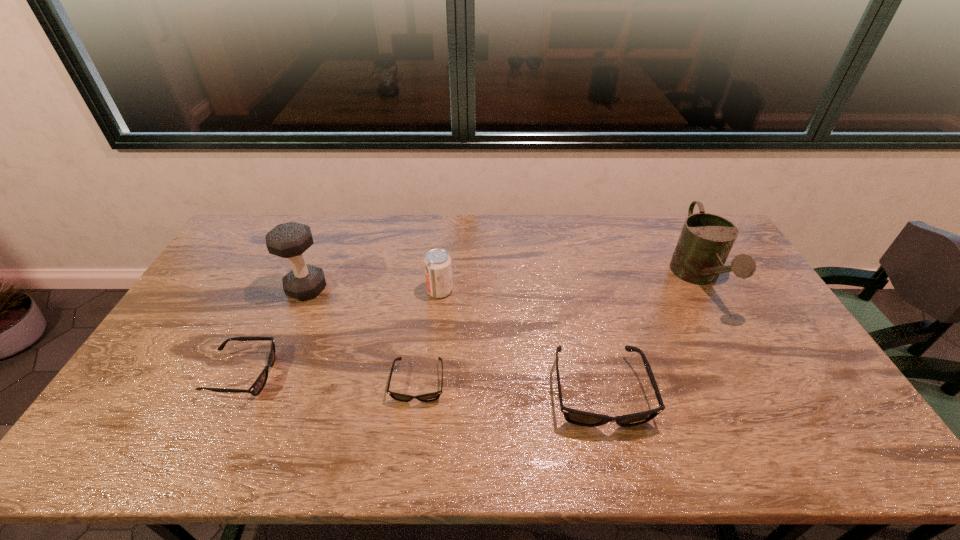
This screenshot has width=960, height=540. Identify the location of free space that is in between the watering can and the second shortest object. (470, 326).

I want to click on empty space that is in between the dumbbell and the fifth tallest object, so click(275, 332).

Identify the location of object that ranks as the fifth closest to the tallest sunglasses. (258, 385).

In order to click on object that is the fifth nearest to the fourth shortest object in this screenshot , I will do `click(706, 240)`.

Locate an element on the screen. sunglasses identified as the second closest to the soda can is located at coordinates click(x=576, y=417).

This screenshot has width=960, height=540. I want to click on the closest sunglasses to the soda can, so click(429, 397).

Find the location of a particular element. The height and width of the screenshot is (540, 960). free space that satisfies the following two spatial constraints: 1. on the front side of the dumbbell; 2. on the front-facing side of the leftmost sunglasses is located at coordinates (270, 375).